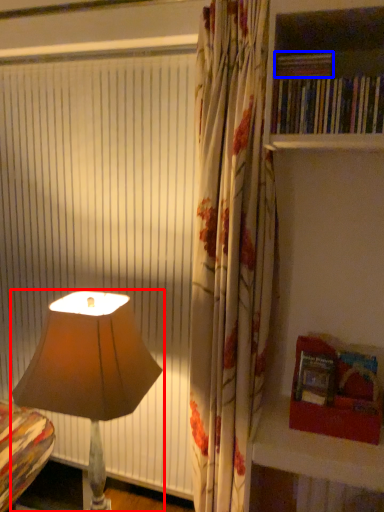
Question: Which of the following is the closest to the observer, lamp (highlighted by a red box) or book (highlighted by a blue box)?

Choices:
 (A) lamp
 (B) book

Answer: (B)